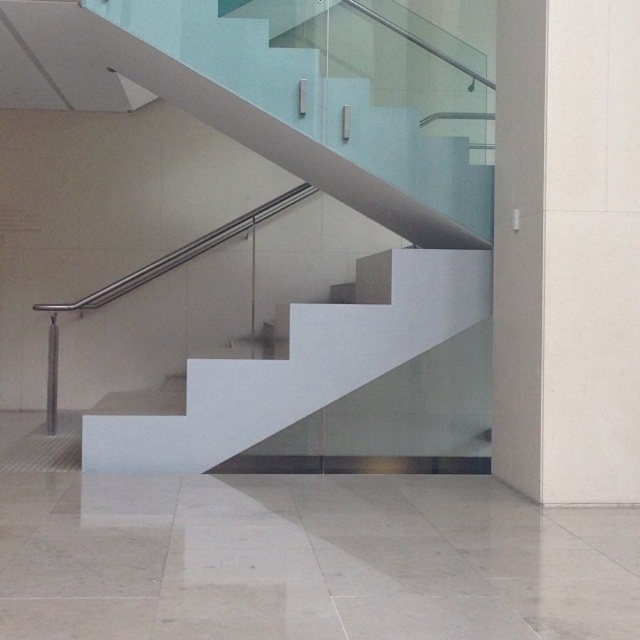
Is point (205, 406) farther from camera compared to point (579, 236)?

Yes, it is.

Find the location of a particular element. white glossy stairs at center is located at coordinates (321, 198).